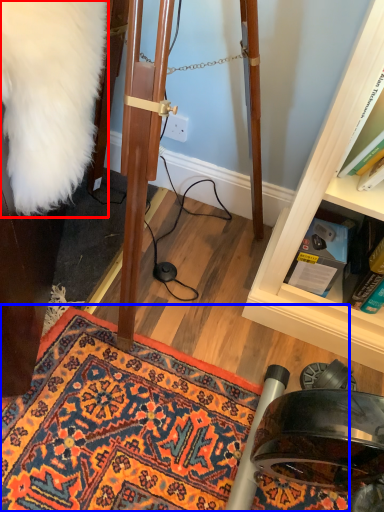
Question: Which object appears closest to the camera in this image, fur coat (highlighted by a red box) or doormat (highlighted by a blue box)?

Choices:
 (A) fur coat
 (B) doormat

Answer: (A)